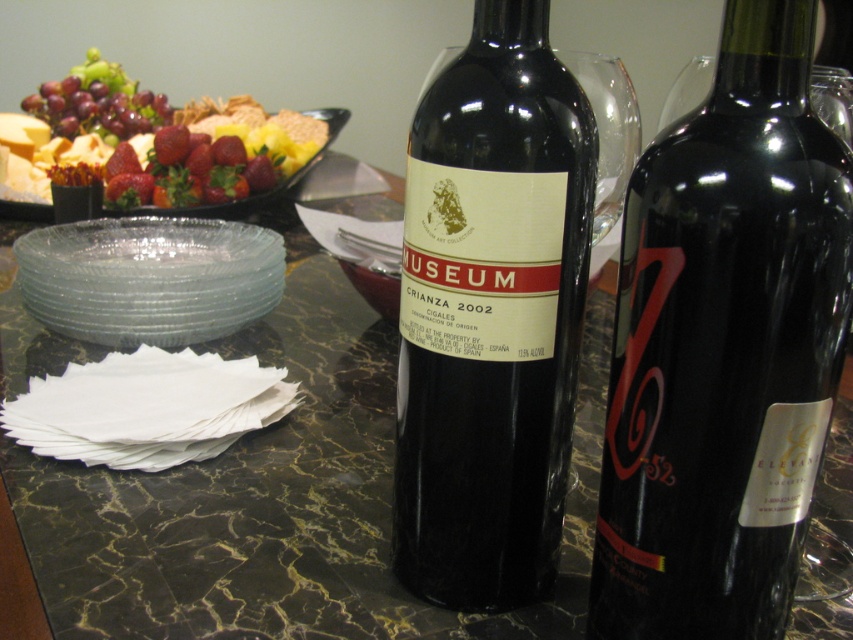
Is black glass bottle at center thinner than glassy clear platter at upper left?

Correct, black glass bottle at center's width is less than glassy clear platter at upper left's.

Does point (720, 88) come in front of point (341, 108)?

Yes, point (720, 88) is closer to viewer.

This screenshot has width=853, height=640. Identify the location of black glass bottle at center. (724, 346).

Does shiny red grapes at upper left come behind glassy clear platter at upper left?

Yes, shiny red grapes at upper left is further from the viewer.

Is shiny red grapes at upper left closer to camera compared to glassy clear platter at upper left?

No.

Who is more distant from viewer, (113, 76) or (254, 198)?

The point (113, 76) is behind.

I want to click on shiny red grapes at upper left, so 97,102.

Between point (234, 157) and point (148, 104), which one is positioned behind?

Positioned behind is point (148, 104).

Does shiny red strawberries at upper left have a lesser height compared to shiny red grapes at upper left?

Indeed, shiny red strawberries at upper left has a lesser height compared to shiny red grapes at upper left.

Is point (219, 176) more distant than point (32, 102)?

No, (219, 176) is in front of (32, 102).

Where is `shiny red strawberries at upper left`? shiny red strawberries at upper left is located at coordinates (186, 172).